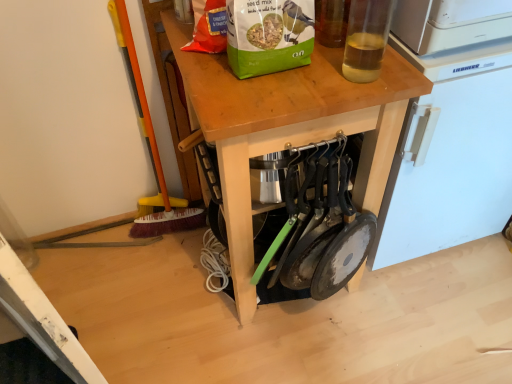
Image resolution: width=512 pixels, height=384 pixels. In order to click on blank space above wooden at center (from a real-world perspective) in this screenshot , I will do `click(289, 70)`.